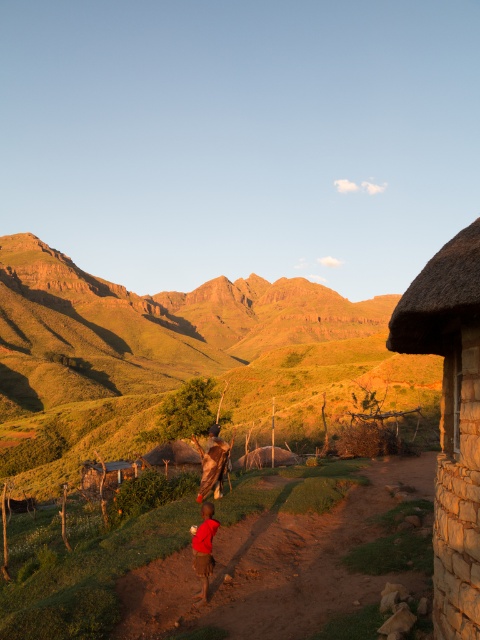
Does brown dirt path at lower center have a smaller size compared to brown leather bag at center?

Incorrect, brown dirt path at lower center is not smaller in size than brown leather bag at center.

How much distance is there between brown dirt path at lower center and brown leather bag at center?

brown dirt path at lower center is 5.46 meters from brown leather bag at center.

Identify the location of brown dirt path at lower center. (277, 566).

Which is in front, point (218, 524) or point (217, 444)?

Positioned in front is point (218, 524).

Measure the distance between red cotton shirt at center and camera.

red cotton shirt at center is 10.72 meters from camera.

Between point (202, 560) and point (222, 460), which one is positioned in front?

Point (202, 560) is more forward.

This screenshot has width=480, height=640. What are the coordinates of `red cotton shirt at center` in the screenshot? It's located at (204, 550).

Is green grassy mountain at upper left bigger than brown dirt path at lower center?

Yes, green grassy mountain at upper left is bigger than brown dirt path at lower center.

This screenshot has height=640, width=480. I want to click on green grassy mountain at upper left, so click(x=180, y=358).